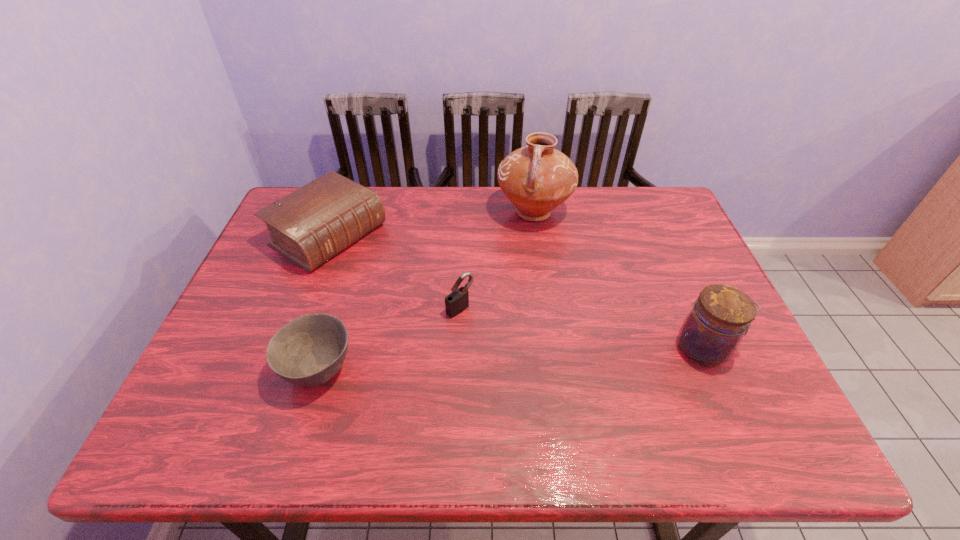
You are a GUI agent. You are given a task and a screenshot of the screen. Output one action in this format:
    pyautogui.click(x=<x>, y=<y>)
    Task: Click on the vacant space that's between the Bible and the second tallest object
    The height and width of the screenshot is (540, 960).
    Given the screenshot: What is the action you would take?
    pyautogui.click(x=516, y=292)

At what (x,y) coordinates should I click in order to perform the action: click on free space between the Bible and the padlock. Please return your answer as a coordinate pair (x, y). The width and height of the screenshot is (960, 540). Looking at the image, I should click on (395, 272).

The width and height of the screenshot is (960, 540). I want to click on free space that is in between the Bible and the fourth shortest object, so click(516, 292).

This screenshot has height=540, width=960. Find the location of `free space between the jar and the second object from right to left`. free space between the jar and the second object from right to left is located at coordinates (619, 280).

Find the location of `free space between the jar and the padlock`. free space between the jar and the padlock is located at coordinates (583, 328).

This screenshot has height=540, width=960. Find the location of `free space between the rightmost object and the bowl`. free space between the rightmost object and the bowl is located at coordinates (512, 359).

You are a GUI agent. You are given a task and a screenshot of the screen. Output one action in this format:
    pyautogui.click(x=<x>, y=<y>)
    Task: Click on the vacant region between the Bible and the jar
    This screenshot has height=540, width=960.
    Given the screenshot: What is the action you would take?
    pyautogui.click(x=516, y=292)

The height and width of the screenshot is (540, 960). Find the location of `free space that is in between the padlock and the Bible`. free space that is in between the padlock and the Bible is located at coordinates (395, 272).

Where is `free space that is in between the pottery and the jar`? The image size is (960, 540). free space that is in between the pottery and the jar is located at coordinates (619, 280).

Where is `object that is the second closest to the third farthest object`? This screenshot has width=960, height=540. object that is the second closest to the third farthest object is located at coordinates (311, 225).